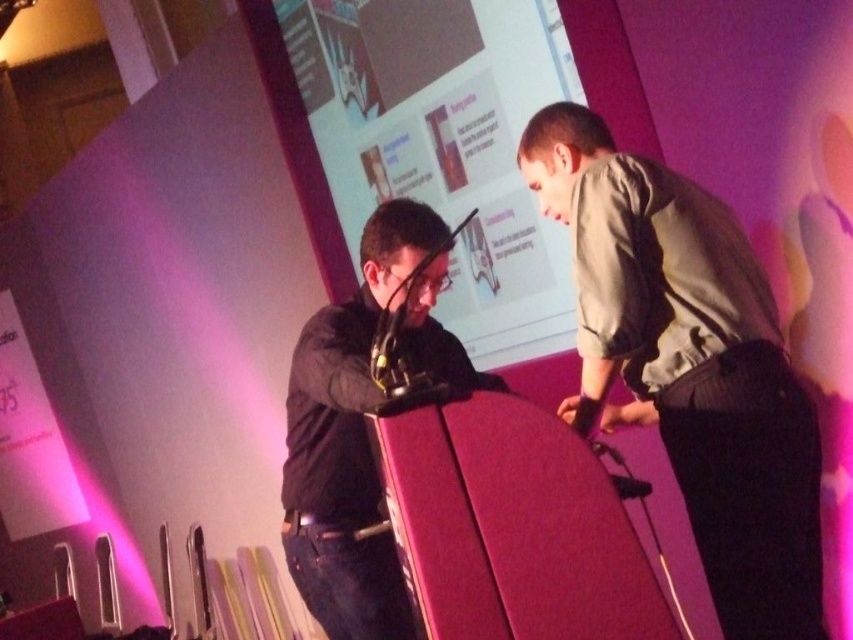
You are an attendee at this presentation. You notice two presenters on stage. The one wearing a light gray fabric shirt at right is standing to the right of the black matte jacket at center. If you want to ask a question to the presenter closer to the podium microphone, which presenter should you address?

The black matte jacket at center is closer to the podium microphone because the light gray fabric shirt at right is positioned to the right of the black matte jacket at center, meaning the black matte jacket at center is nearer to the center of the stage where the microphone is located.

You are an event organizer setting up chairs for an audience. You notice the light gray fabric shirt at right and the black matte jacket at center in the image. Which of these two items is placed higher in the scene?

The light gray fabric shirt at right is positioned over the black matte jacket at center, so it is higher in the scene.